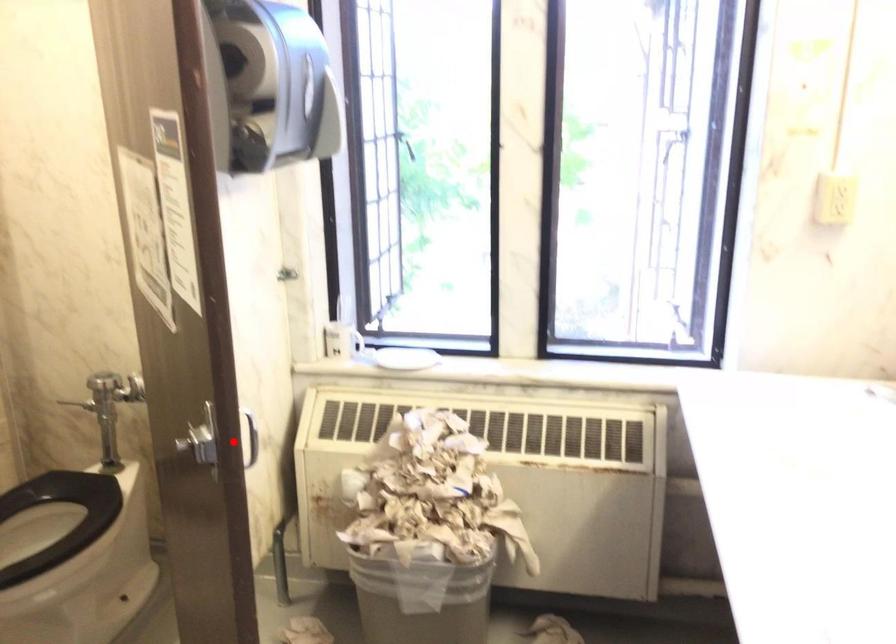
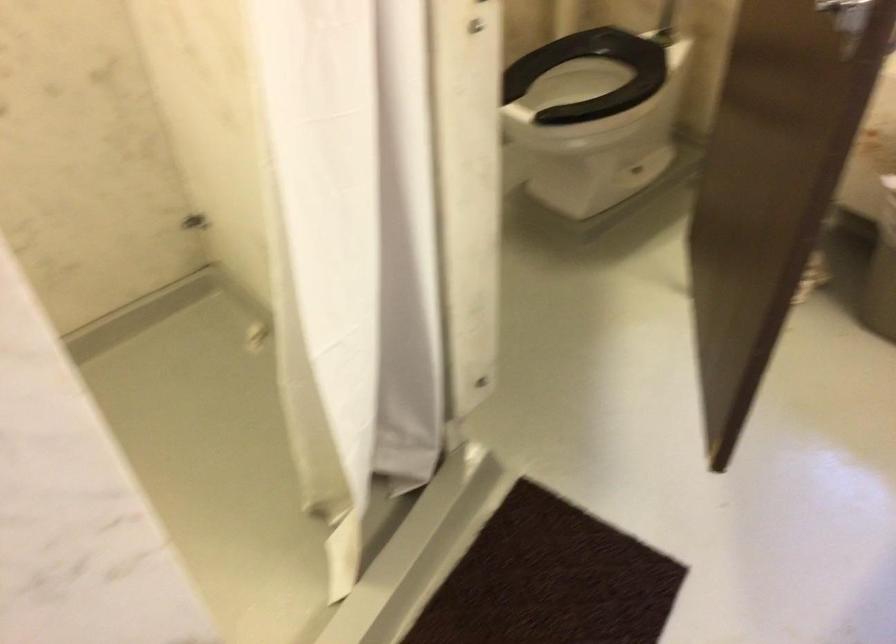
Find the pixel in the second image that matches the highlighted location in the first image.

(849, 14)